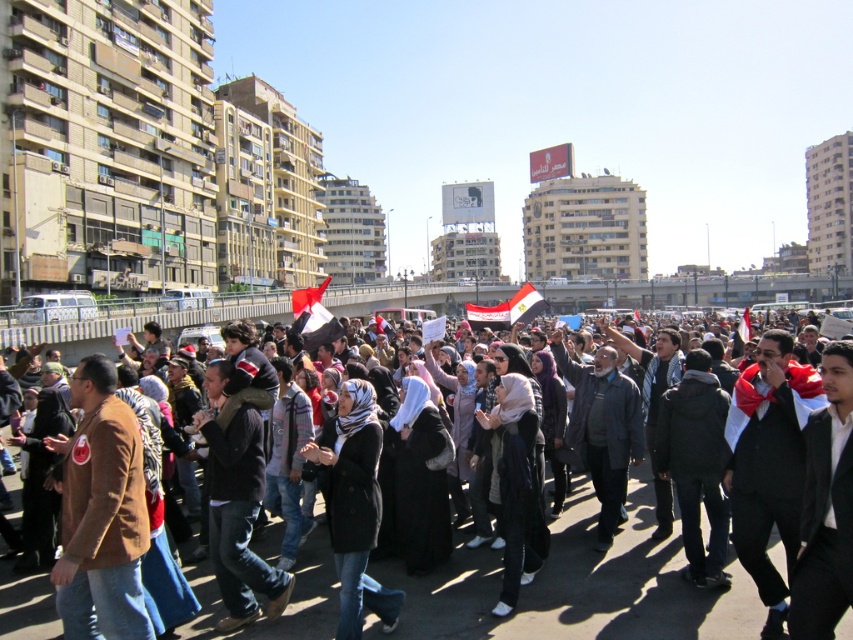
Is white fabric scarf at center thinner than dark gray jacket at center?

No, white fabric scarf at center is not thinner than dark gray jacket at center.

Does point (764, 332) come in front of point (647, 448)?

No, it is behind (647, 448).

Locate an element on the screen. Image resolution: width=853 pixels, height=640 pixels. white fabric scarf at center is located at coordinates (769, 465).

Between black suit at center and dark gray coat at center, which one is positioned lower?

black suit at center is lower down.

Who is more forward, (x=827, y=388) or (x=625, y=458)?

Point (x=827, y=388) is more forward.

Where is `black suit at center`? black suit at center is located at coordinates (827, 508).

Who is positioned more to the left, dark gray coat at center or dark gray jacket at center?

dark gray coat at center

What do you see at coordinates (602, 428) in the screenshot? The image size is (853, 640). I see `dark gray coat at center` at bounding box center [602, 428].

Image resolution: width=853 pixels, height=640 pixels. I want to click on dark gray coat at center, so click(602, 428).